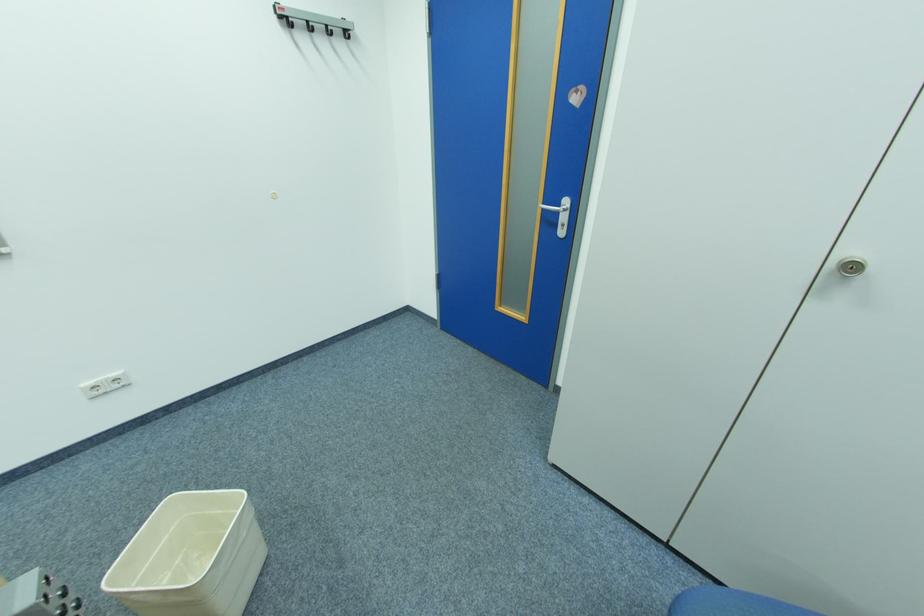
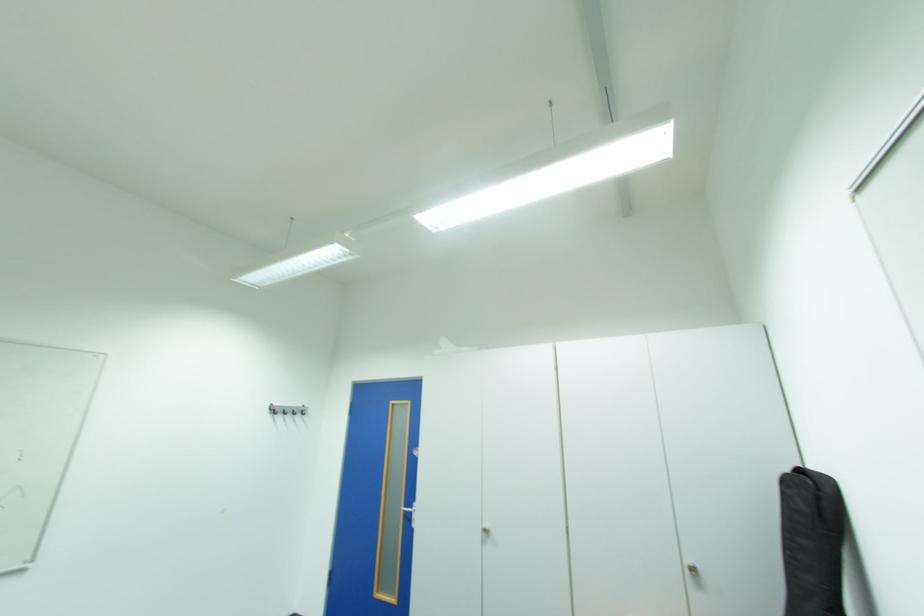
Find the pixel in the second image that matches pixel 552 209 in the first image.

(414, 511)